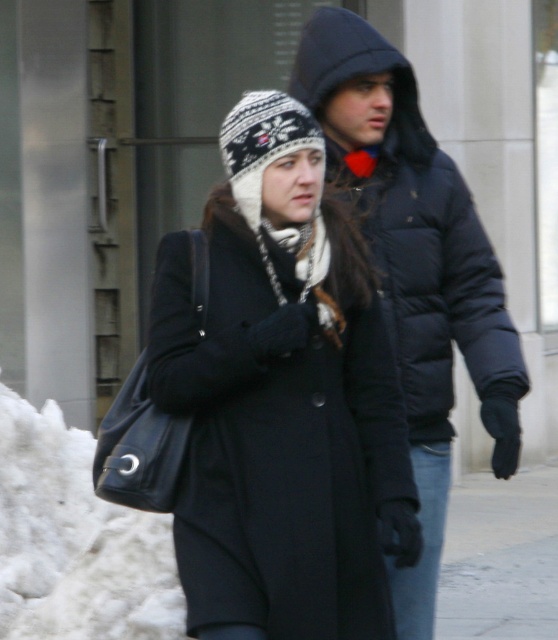
Does matte black puffer jacket at center have a larger size compared to white knitted scarf at center?

Correct, matte black puffer jacket at center is larger in size than white knitted scarf at center.

Measure the distance between point (449,481) and camera.

Point (449,481) and camera are 19.55 feet apart.

Is point (434, 323) less distant than point (296, 252)?

No, it is behind (296, 252).

This screenshot has width=558, height=640. I want to click on matte black puffer jacket at center, so click(x=415, y=268).

Where is `matte black coat at center`? matte black coat at center is located at coordinates (281, 397).

Find the location of a particular element. Image resolution: width=558 pixels, height=640 pixels. matte black coat at center is located at coordinates (281, 397).

You are a GUI agent. You are given a task and a screenshot of the screen. Output one action in this format:
    pyautogui.click(x=<x>, y=<y>)
    Task: Click on the matte black coat at center
    This screenshot has width=558, height=640.
    Given the screenshot: What is the action you would take?
    pyautogui.click(x=281, y=397)

Can you confirm if matte black coat at center is positioned below white knitted scarf at center?

Correct, matte black coat at center is located below white knitted scarf at center.

Can you confirm if matte black coat at center is bigger than white knitted scarf at center?

Yes, matte black coat at center is bigger than white knitted scarf at center.

Is point (223, 429) less distant than point (320, 308)?

Yes.

Locate an element on the screen. matte black coat at center is located at coordinates (281, 397).